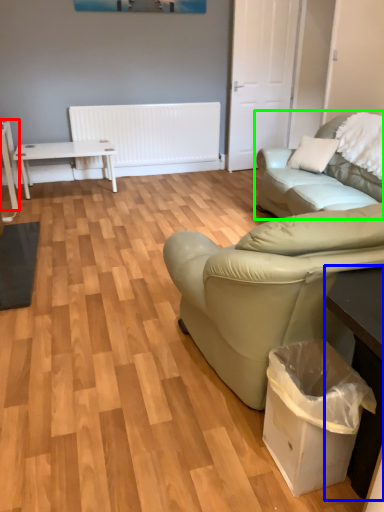
Question: Which is farther away from table (highlighted by a red box)? table (highlighted by a blue box) or studio couch (highlighted by a green box)?

Choices:
 (A) table
 (B) studio couch

Answer: (A)